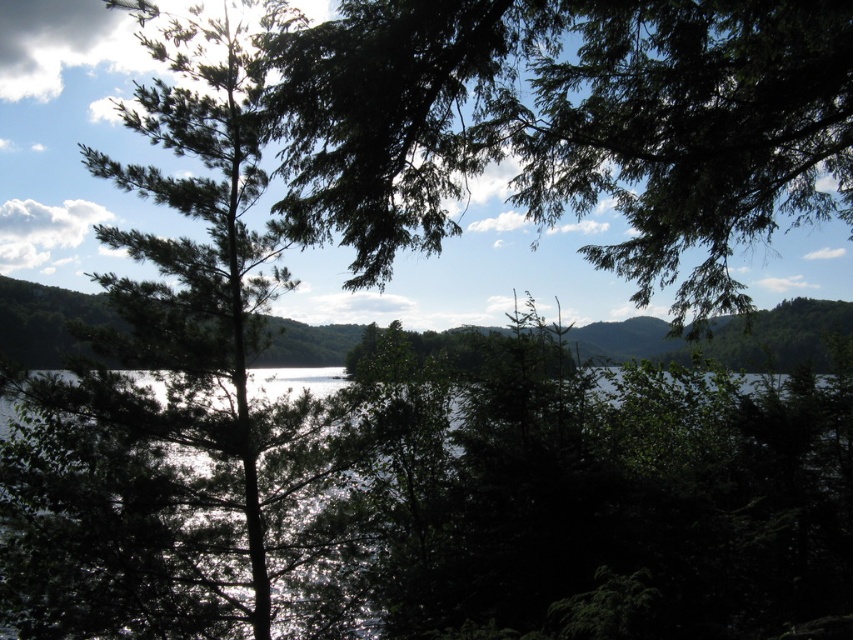
Question: Which point is farther to the camera?

Choices:
 (A) glistening water at center
 (B) green leafy tree at center

Answer: (A)

Question: Does glistening water at center appear on the right side of green leafy tree at center?

Choices:
 (A) yes
 (B) no

Answer: (A)

Question: Where is glistening water at center located in relation to green leafy tree at center in the image?

Choices:
 (A) above
 (B) below

Answer: (B)

Question: Which object appears closest to the camera in this image?

Choices:
 (A) green leafy tree at center
 (B) glistening water at center

Answer: (A)

Question: Is glistening water at center to the right of green leafy tree at center from the viewer's perspective?

Choices:
 (A) yes
 (B) no

Answer: (A)